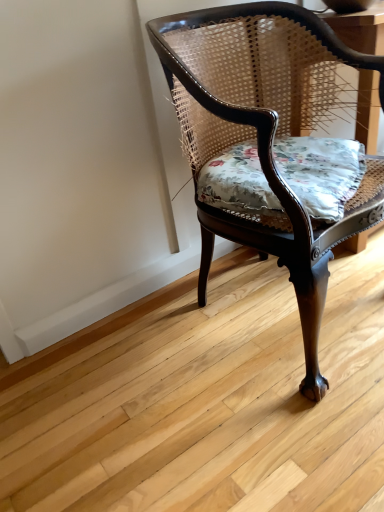
Locate an element on the screen. The height and width of the screenshot is (512, 384). vacant region under mahogany cane chair at center (from a real-world perspective) is located at coordinates (274, 306).